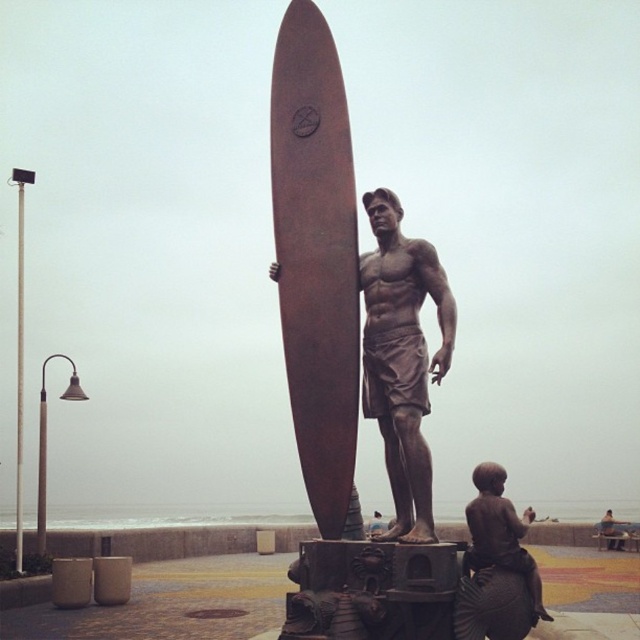
Question: Which point is closer to the camera?

Choices:
 (A) rusty brown surfboard at center
 (B) bronze statue at center

Answer: (B)

Question: Where is rusty brown surfboard at center located in relation to bronze statue at center in the image?

Choices:
 (A) below
 (B) above

Answer: (B)

Question: Which point is closer to the camera?

Choices:
 (A) brown matte statue at lower right
 (B) rusty brown surfboard at center

Answer: (A)

Question: Which is nearer to the bronze statue at center?

Choices:
 (A) brown matte statue at lower right
 (B) rusty brown surfboard at center

Answer: (B)

Question: Can you confirm if rusty brown surfboard at center is smaller than bronze statue at center?

Choices:
 (A) yes
 (B) no

Answer: (B)

Question: Can you confirm if rusty brown surfboard at center is positioned above brown matte statue at lower right?

Choices:
 (A) no
 (B) yes

Answer: (B)